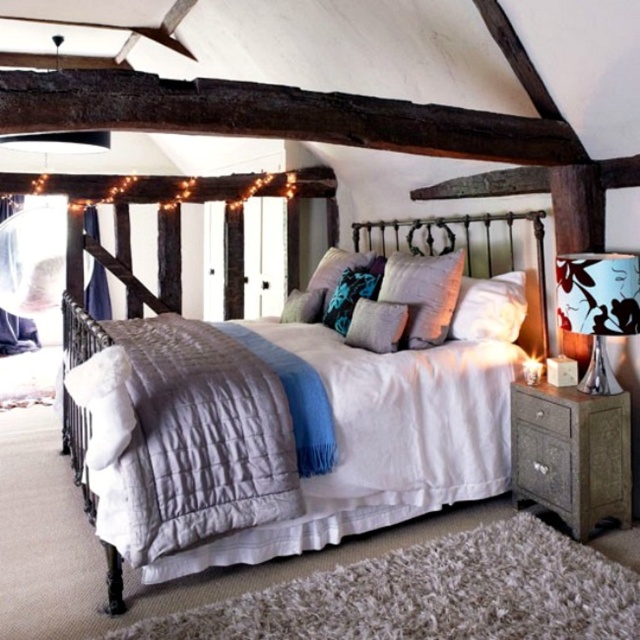
Question: Does blue fabric lampshade at right appear under textured gray pillow at center?

Choices:
 (A) yes
 (B) no

Answer: (B)

Question: Estimate the real-world distances between objects in this image. Which object is farther from the white soft pillow at center?

Choices:
 (A) velvet blue pillow at center
 (B) velvet floral pillow at center

Answer: (A)

Question: Does metallic wrought iron headboard at center have a smaller size compared to textured gray pillow at center?

Choices:
 (A) no
 (B) yes

Answer: (A)

Question: Is blue fabric lampshade at right above velvet floral pillow at center?

Choices:
 (A) no
 (B) yes

Answer: (A)

Question: Which of the following is the farthest from the observer?

Choices:
 (A) (460, 320)
 (B) (384, 339)

Answer: (A)

Question: Which object is positioned closest to the metallic wrought iron headboard at center?

Choices:
 (A) velvet floral pillow at center
 (B) velvet blue pillow at center

Answer: (A)